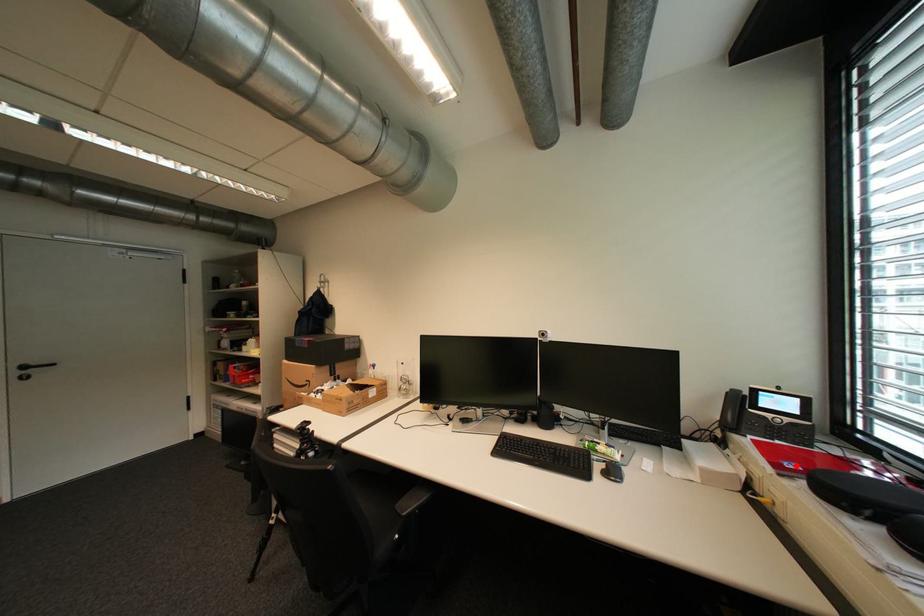
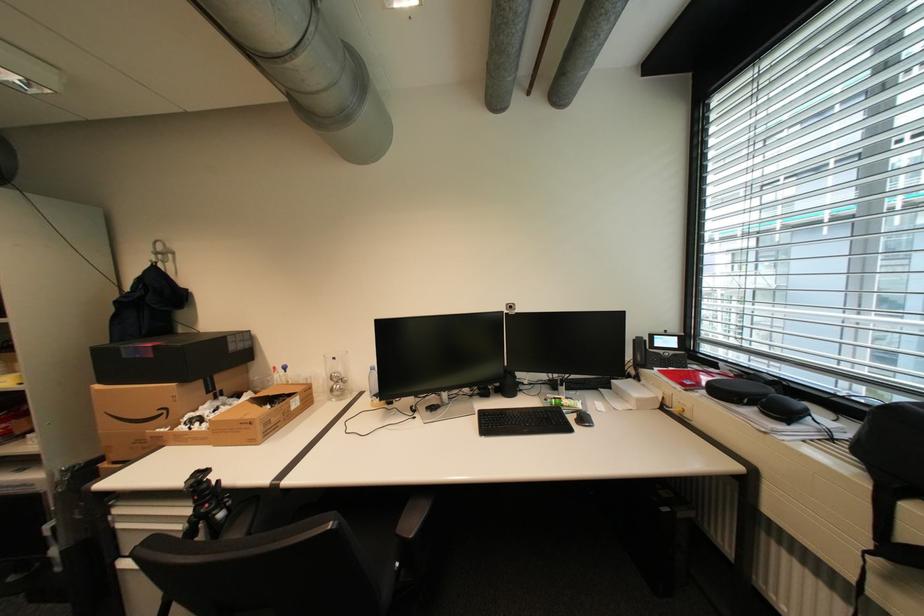
In the second image, find the point that corresponds to the highlighted location in the first image.

(695, 383)